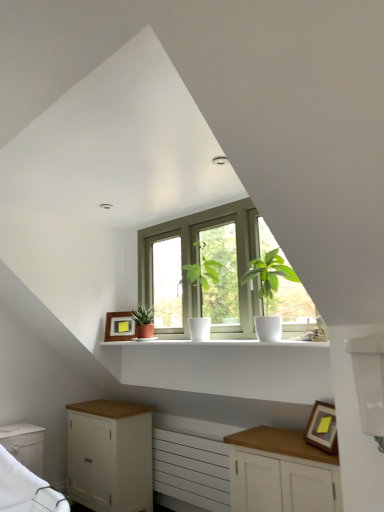
Question: Visually, is wooden framed picture at lower right, which is the 1th picture frame in bottom-to-top order, positioned to the left or to the right of green matte window at center?

Choices:
 (A) left
 (B) right

Answer: (B)

Question: In terms of size, does wooden framed picture at lower right, which is counted as the first picture frame, starting from the front, appear bigger or smaller than green matte window at center?

Choices:
 (A) small
 (B) big

Answer: (A)

Question: Which is nearer to the wooden framed picture at lower right, acting as the 2th picture frame starting from the left?

Choices:
 (A) white glossy shelf at center
 (B) white matte radiator at lower center
 (C) matte wooden picture frame at center, which is the 1th picture frame in top-to-bottom order
 (D) green leafy plant in white pot at center, marked as the second houseplant in a back-to-front arrangement
 (E) green matte plant at center, marked as the first houseplant in a left-to-right arrangement

Answer: (A)

Question: Estimate the real-world distances between objects in this image. Which object is farther from the matte wooden picture frame at center, positioned as the first picture frame in back-to-front order?

Choices:
 (A) white fabric bed frame at lower left
 (B) white wood cabinet at lower left, the third cabinetry positioned from the front
 (C) white glossy shelf at center
 (D) wooden framed picture at lower right, which ranks as the 1th picture frame in right-to-left order
 (E) white matte cabinet at lower left, which is the 1th cabinetry in left-to-right order

Answer: (D)